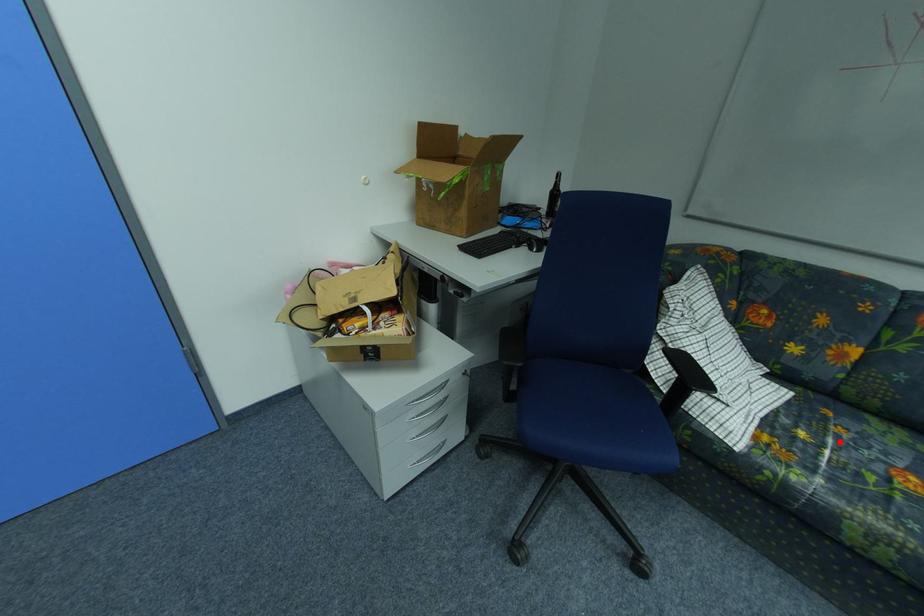
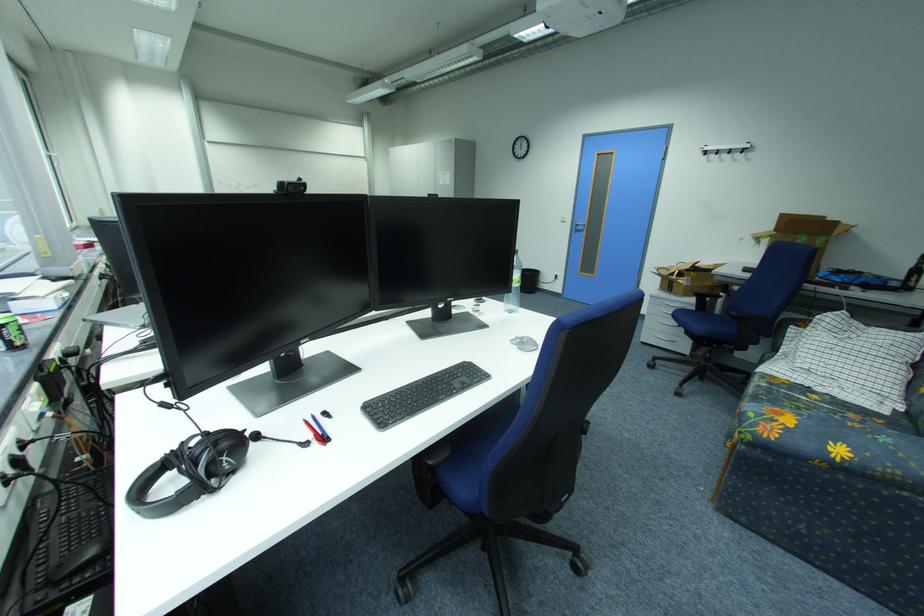
Find the pixel in the second image that matches the highlighted location in the first image.

(834, 407)